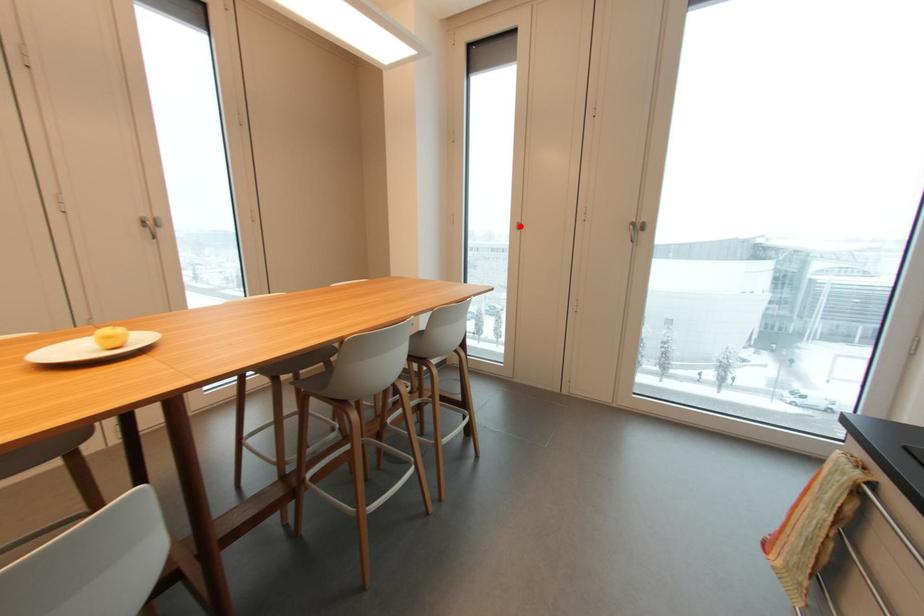
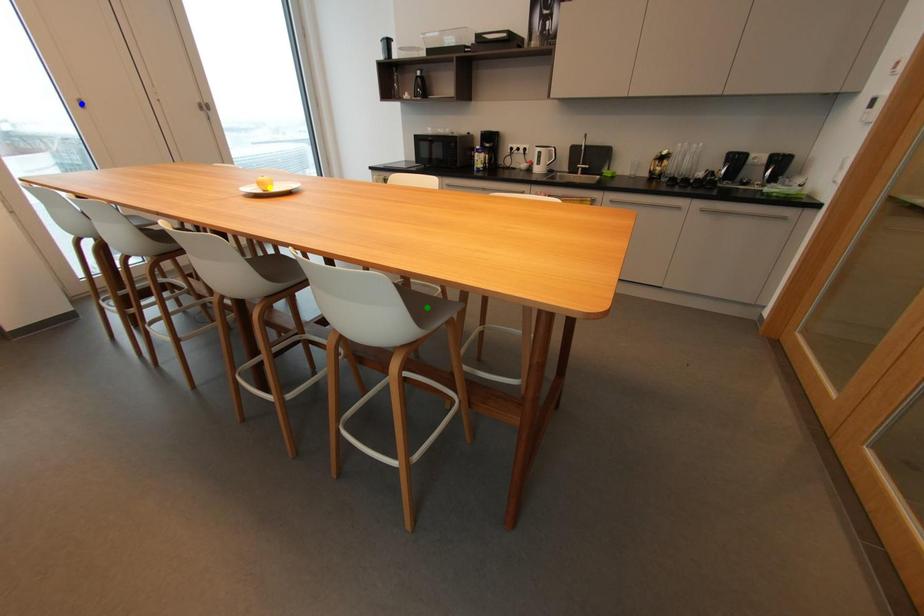
Question: I am providing you with two images of the same scene from different viewpoints. A red point is marked on the first image. You are given multiple points on the second image. Which point in image 2 is actually the same real-world point as the red point in image 1?

Choices:
 (A) blue point
 (B) yellow point
 (C) green point

Answer: (A)